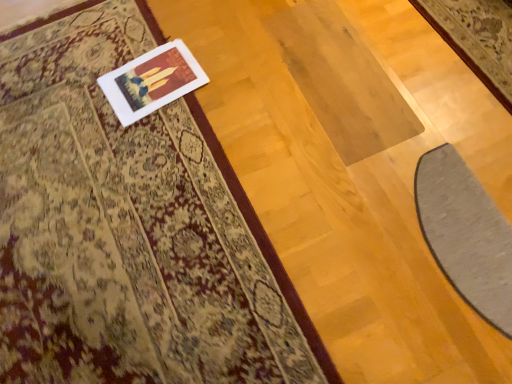
Measure the distance between point [158,72] and camera.

Point [158,72] is 1.32 meters from camera.

In order to face silky beige rug at upper left, should I rotate leftwards or rightwards?

You should look left and rotate roughly 20.739 degrees.

At what (x,y) coordinates should I click in order to perform the action: click on gray soft mat at lower right. Please return your answer as a coordinate pair (x, y). Image resolution: width=512 pixels, height=384 pixels. Looking at the image, I should click on (466, 234).

This screenshot has width=512, height=384. Find the location of `white matte picture frame at upper left`. white matte picture frame at upper left is located at coordinates (152, 81).

From a real-world perspective, is silky beige rug at upper left above or below gray soft mat at lower right?

silky beige rug at upper left is situated higher than gray soft mat at lower right in the real world.

Considering the relative positions of silky beige rug at upper left and gray soft mat at lower right in the image provided, is silky beige rug at upper left behind gray soft mat at lower right?

No, silky beige rug at upper left is in front of gray soft mat at lower right.

Are silky beige rug at upper left and gray soft mat at lower right far apart?

No, silky beige rug at upper left is in close proximity to gray soft mat at lower right.

Is silky beige rug at upper left not inside gray soft mat at lower right?

Yes, silky beige rug at upper left is not within gray soft mat at lower right.

Is silky beige rug at upper left inside or outside of white matte picture frame at upper left?

silky beige rug at upper left exists outside the volume of white matte picture frame at upper left.

Can you confirm if silky beige rug at upper left is positioned to the left of white matte picture frame at upper left?

Yes, silky beige rug at upper left is to the left of white matte picture frame at upper left.

Is point (3, 80) closer to camera compared to point (169, 75)?

No, (3, 80) is behind (169, 75).

Who is shorter, silky beige rug at upper left or white matte picture frame at upper left?

white matte picture frame at upper left.

Is gray soft mat at lower right positioned with its back to white matte picture frame at upper left?

No, gray soft mat at lower right is not facing away from white matte picture frame at upper left.

Is gray soft mat at lower right closer to camera compared to white matte picture frame at upper left?

Yes, it is in front of white matte picture frame at upper left.

Is gray soft mat at lower right far from white matte picture frame at upper left?

No, gray soft mat at lower right is in close proximity to white matte picture frame at upper left.

How different are the orientations of gray soft mat at lower right and white matte picture frame at upper left in degrees?

6.46 degrees separate the facing orientations of gray soft mat at lower right and white matte picture frame at upper left.

Which is in front, point (488, 251) or point (250, 245)?

The point (250, 245) is closer.

Considering the sizes of gray soft mat at lower right and silky beige rug at upper left in the image, is gray soft mat at lower right wider or thinner than silky beige rug at upper left?

gray soft mat at lower right is thinner than silky beige rug at upper left.

Is gray soft mat at lower right with silky beige rug at upper left?

No, gray soft mat at lower right is not with silky beige rug at upper left.

Who is shorter, gray soft mat at lower right or silky beige rug at upper left?

silky beige rug at upper left is shorter.

Who is bigger, white matte picture frame at upper left or silky beige rug at upper left?

silky beige rug at upper left is bigger.

Measure the distance from white matte picture frame at upper left to silky beige rug at upper left.

white matte picture frame at upper left is 11.04 inches from silky beige rug at upper left.

Is white matte picture frame at upper left to the right of silky beige rug at upper left from the viewer's perspective?

Correct, you'll find white matte picture frame at upper left to the right of silky beige rug at upper left.

From the image's perspective, is white matte picture frame at upper left positioned above or below silky beige rug at upper left?

Clearly, from the image's perspective, white matte picture frame at upper left is above silky beige rug at upper left.

From a real-world perspective, does white matte picture frame at upper left sit lower than gray soft mat at lower right?

Incorrect, from a real-world perspective, white matte picture frame at upper left is higher than gray soft mat at lower right.

Is gray soft mat at lower right at the back of white matte picture frame at upper left?

No, white matte picture frame at upper left is not facing away from gray soft mat at lower right.

Between white matte picture frame at upper left and gray soft mat at lower right, which one has less height?

Standing shorter between the two is white matte picture frame at upper left.

From the image's perspective, who appears lower, white matte picture frame at upper left or gray soft mat at lower right?

gray soft mat at lower right appears lower in the image.

Identify the location of mat above the gray soft mat at lower right (from the image's perspective). The height and width of the screenshot is (384, 512). (129, 228).

What are the coordinates of `mat that appears above the white matte picture frame at upper left (from a real-world perspective)` in the screenshot? It's located at (129, 228).

From the image, which object appears to be farther from white matte picture frame at upper left, gray soft mat at lower right or silky beige rug at upper left?

gray soft mat at lower right.

Based on their spatial positions, is silky beige rug at upper left or white matte picture frame at upper left closer to gray soft mat at lower right?

silky beige rug at upper left is positioned closer to the anchor gray soft mat at lower right.

Looking at the image, which one is located further to silky beige rug at upper left, gray soft mat at lower right or white matte picture frame at upper left?

Based on the image, gray soft mat at lower right appears to be further to silky beige rug at upper left.

Based on their spatial positions, is white matte picture frame at upper left or silky beige rug at upper left further from gray soft mat at lower right?

Based on the image, white matte picture frame at upper left appears to be further to gray soft mat at lower right.

Estimate the real-world distances between objects in this image. Which object is further from white matte picture frame at upper left, silky beige rug at upper left or gray soft mat at lower right?

gray soft mat at lower right lies further to white matte picture frame at upper left than the other object.

Estimate the real-world distances between objects in this image. Which object is closer to silky beige rug at upper left, white matte picture frame at upper left or gray soft mat at lower right?

Among the two, white matte picture frame at upper left is located nearer to silky beige rug at upper left.

Image resolution: width=512 pixels, height=384 pixels. I want to click on picture frame between silky beige rug at upper left and gray soft mat at lower right in the horizontal direction, so click(152, 81).